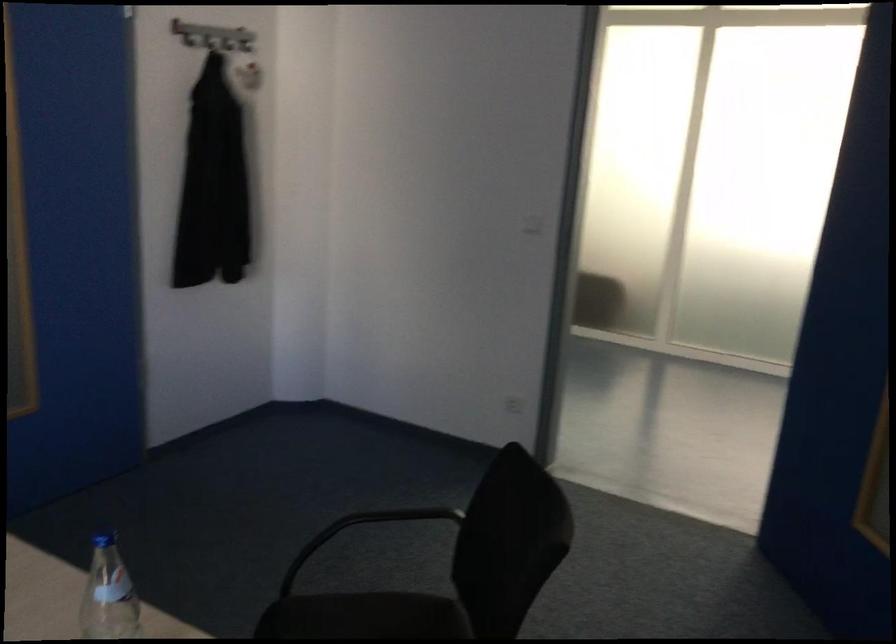
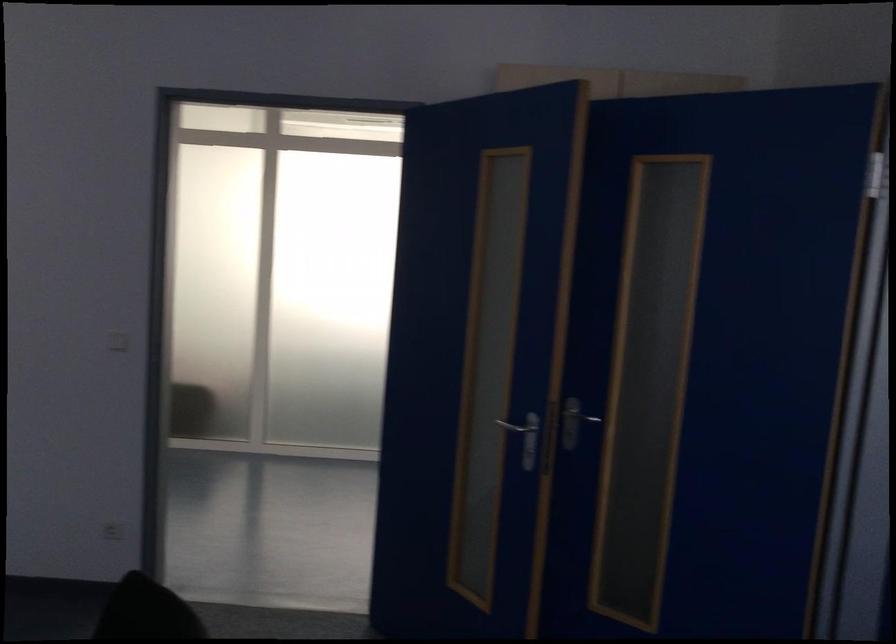
Question: The camera is either moving clockwise (left) or counter-clockwise (right) around the object. The first image is from the beginning of the video and the second image is from the end. Is the camera moving left or right when shooting the video?

Choices:
 (A) Left
 (B) Right

Answer: (A)